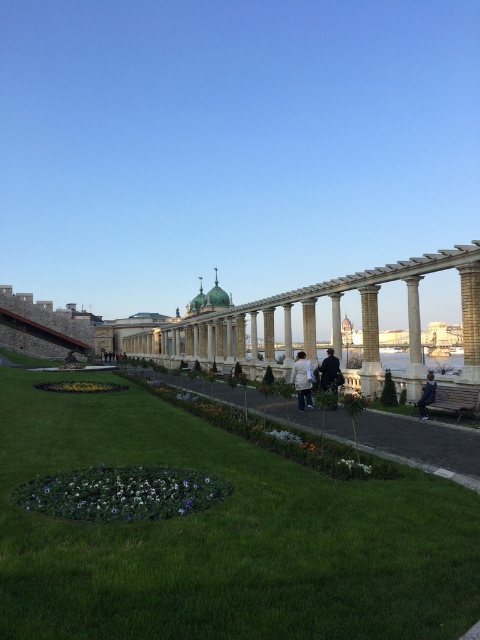
Between green grass at center and dark blue jacket at center, which one has more height?

green grass at center is taller.

Can you confirm if green grass at center is bigger than dark blue jacket at center?

Yes.

Which is in front, point (117, 620) or point (325, 387)?

Point (117, 620) is more forward.

Where is `green grass at center`? green grass at center is located at coordinates (222, 536).

Does point (419, 401) come behind point (430, 371)?

No, (419, 401) is in front of (430, 371).

Is point (432, 397) less distant than point (418, 403)?

Yes, point (432, 397) is closer to viewer.

What are the coordinates of `brown wooden bench at lower right` in the screenshot? It's located at (448, 400).

At what (x,y) coordinates should I click in order to perform the action: click on white fabric jacket at center. Please return your answer as a coordinate pair (x, y). The width and height of the screenshot is (480, 640). Looking at the image, I should click on (302, 380).

Is point (308, 403) more distant than point (330, 362)?

That is True.

Is point (300, 374) positioned before point (337, 368)?

No, (300, 374) is further to viewer.

I want to click on white fabric jacket at center, so click(x=302, y=380).